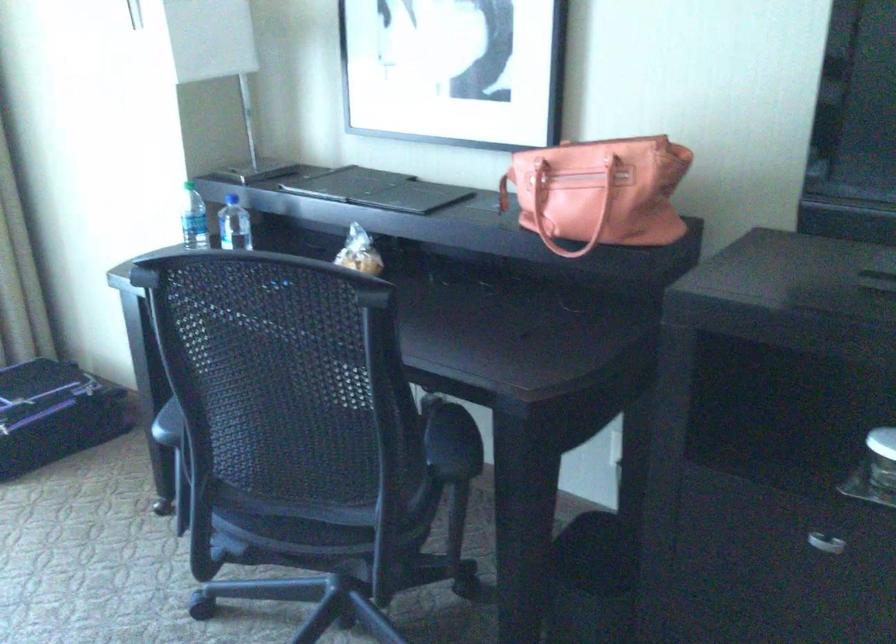
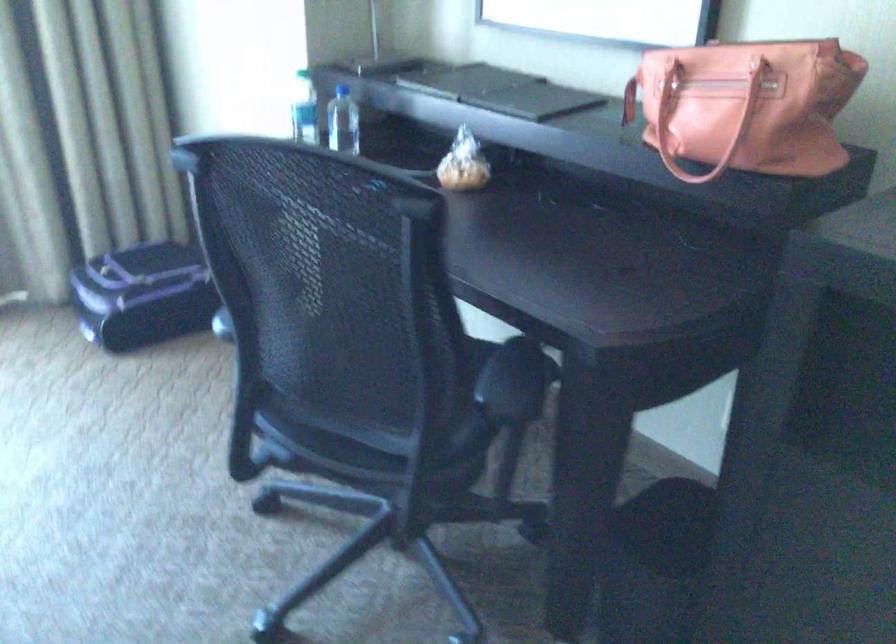
In the second image, find the point that corresponds to [320,520] in the first image.

(364, 440)